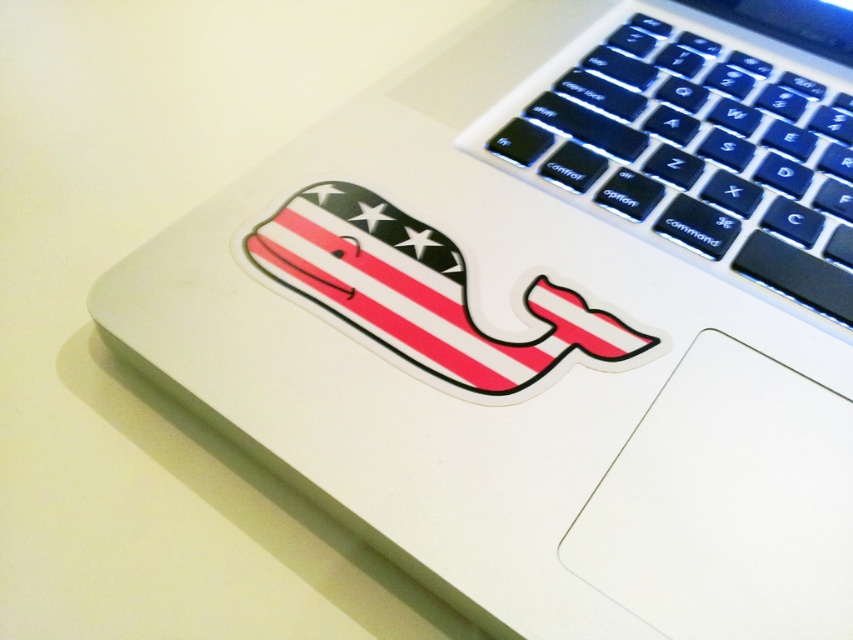
You are using a MacBook and notice two items on the keyboard. One is the black plastic keyboard at upper right and the other is the american flag whale sticker at center. Which one is located higher up on the keyboard?

The black plastic keyboard at upper right is located higher up because it is above the american flag whale sticker at center.

From the picture: You are designing a sticker placement guide for the laptop keyboard shown. The sticker with the whale design is already placed on the spacebar. Now, you need to place a small dot sticker at point [701,141]. Based on the keyboard layout, where exactly on the keyboard should this dot sticker be placed?

The point [701,141] is on the black plastic keyboard at upper right, so the dot sticker should be placed on the black plastic area at the upper right corner of the keyboard.

You are designing a new sticker for the laptop keyboard and want to place it next to the existing american flag whale sticker at center. Given that your new sticker must be smaller than the black plastic keyboard at upper right, can the new sticker fit next to the existing sticker without overlapping?

The black plastic keyboard at upper right is wider than the american flag whale sticker at center. Since your new sticker must be smaller than the keyboard, it will also be smaller than the existing sticker. Therefore, the new sticker can fit next to the american flag whale sticker at center without overlapping as long as there is enough space between them.